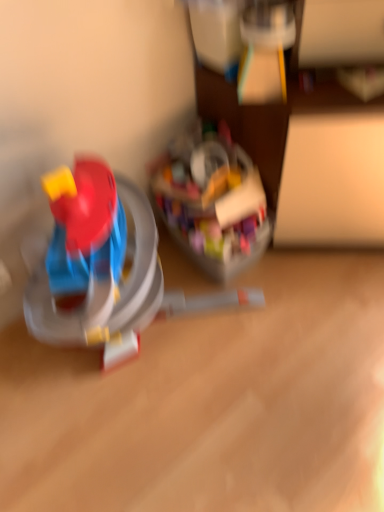
Question: Is translucent plastic toy at center, marked as the second toy in a right-to-left arrangement, taller than translucent plastic container at center, acting as the first toy starting from the right?

Choices:
 (A) yes
 (B) no

Answer: (A)

Question: Is translucent plastic toy at center, which is the first toy in left-to-right order, turned away from translucent plastic container at center, acting as the first toy starting from the right?

Choices:
 (A) no
 (B) yes

Answer: (A)

Question: Is translucent plastic toy at center, which is the first toy in left-to-right order, further to camera compared to translucent plastic container at center, acting as the first toy starting from the right?

Choices:
 (A) no
 (B) yes

Answer: (A)

Question: Would you say translucent plastic toy at center, which is the first toy in left-to-right order, is outside translucent plastic container at center, acting as the first toy starting from the right?

Choices:
 (A) yes
 (B) no

Answer: (A)

Question: Is translucent plastic toy at center, which is the first toy in left-to-right order, facing towards translucent plastic container at center, acting as the first toy starting from the right?

Choices:
 (A) no
 (B) yes

Answer: (A)

Question: From a real-world perspective, is translucent plastic toy at center, which is the first toy in left-to-right order, beneath translucent plastic container at center, the 2th toy from the left?

Choices:
 (A) yes
 (B) no

Answer: (B)

Question: From the image's perspective, is translucent plastic container at center, acting as the first toy starting from the right, located above translucent plastic toy at center, marked as the second toy in a right-to-left arrangement?

Choices:
 (A) yes
 (B) no

Answer: (A)

Question: Is translucent plastic container at center, acting as the first toy starting from the right, at the right side of translucent plastic toy at center, marked as the second toy in a right-to-left arrangement?

Choices:
 (A) yes
 (B) no

Answer: (A)

Question: Is translucent plastic container at center, acting as the first toy starting from the right, with translucent plastic toy at center, marked as the second toy in a right-to-left arrangement?

Choices:
 (A) yes
 (B) no

Answer: (B)

Question: Is translucent plastic container at center, the 2th toy from the left, bigger than translucent plastic toy at center, marked as the second toy in a right-to-left arrangement?

Choices:
 (A) yes
 (B) no

Answer: (B)

Question: From a real-world perspective, is translucent plastic container at center, acting as the first toy starting from the right, located beneath translucent plastic toy at center, which is the first toy in left-to-right order?

Choices:
 (A) yes
 (B) no

Answer: (A)

Question: Is the position of translucent plastic container at center, the 2th toy from the left, less distant than that of translucent plastic toy at center, marked as the second toy in a right-to-left arrangement?

Choices:
 (A) no
 (B) yes

Answer: (A)

Question: In the image, is translucent plastic toy at center, which is the first toy in left-to-right order, positioned in front of or behind translucent plastic container at center, the 2th toy from the left?

Choices:
 (A) behind
 (B) front

Answer: (B)